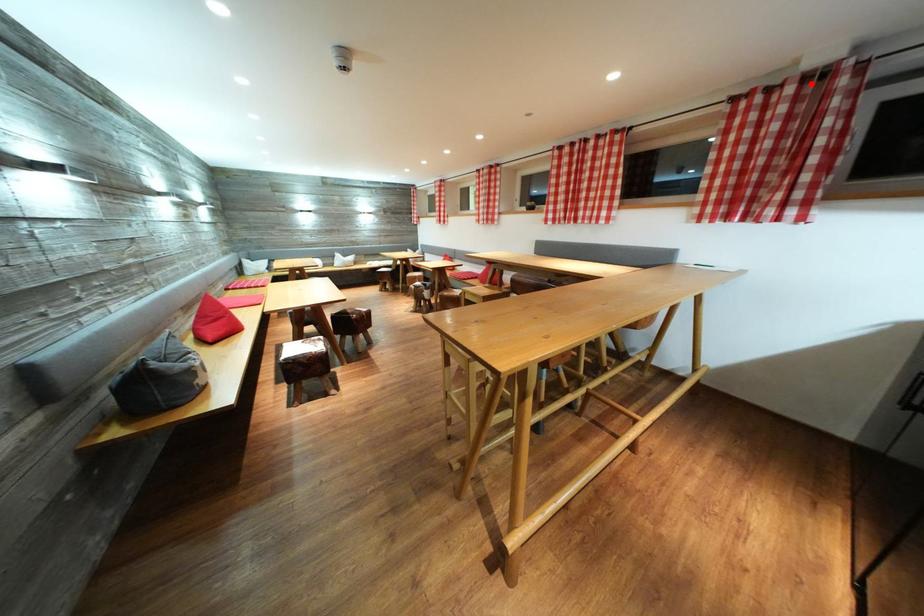
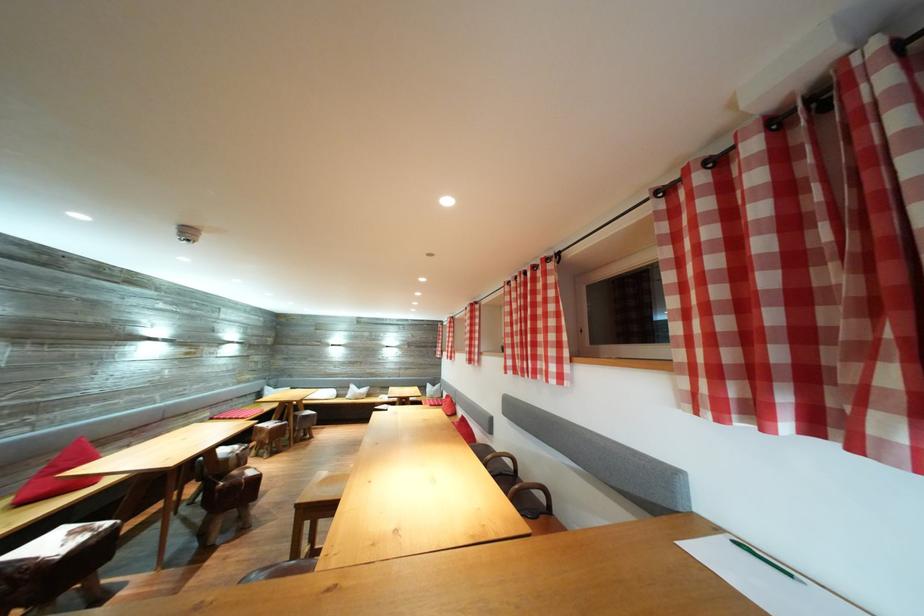
Where in the second image is the point corresponding to the highlighted location from the first image?

(784, 127)